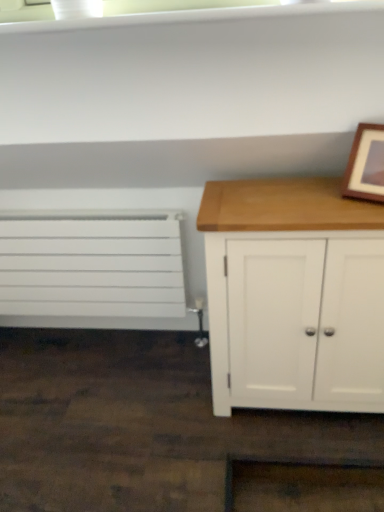
Image resolution: width=384 pixels, height=512 pixels. I want to click on free spot in front of white matte radiator at left, so (98, 407).